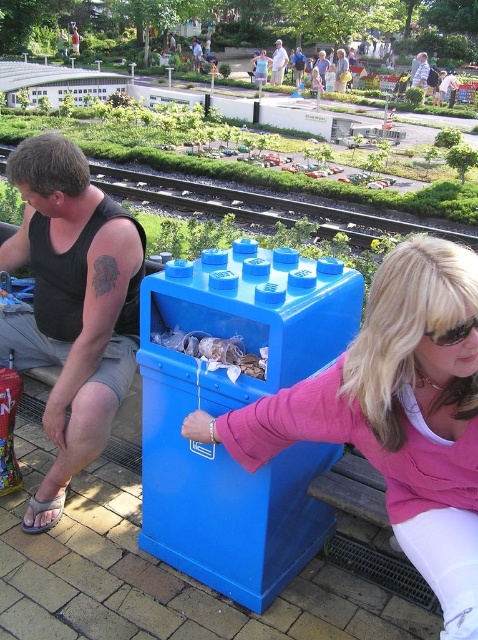
Question: Which of the following is the closest to the observer?

Choices:
 (A) (54, 280)
 (B) (203, 419)
 (C) (174, 202)
 (D) (275, 70)

Answer: (B)

Question: Is blue plastic trash can at center smaller than light brown wooden bench at center?

Choices:
 (A) no
 (B) yes

Answer: (B)

Question: Considering the relative positions of smooth white statue at upper center and light brown wooden bench at center in the image provided, where is smooth white statue at upper center located with respect to light brown wooden bench at center?

Choices:
 (A) left
 (B) right

Answer: (A)

Question: Is pink matte sweater at center positioned at the back of blue plastic train track at center?

Choices:
 (A) no
 (B) yes

Answer: (A)

Question: Which point is farther from the camera taking this photo?

Choices:
 (A) (453, 333)
 (B) (213, 189)

Answer: (B)

Question: Which point is closer to the camera?

Choices:
 (A) (246, 369)
 (B) (437, 340)

Answer: (B)